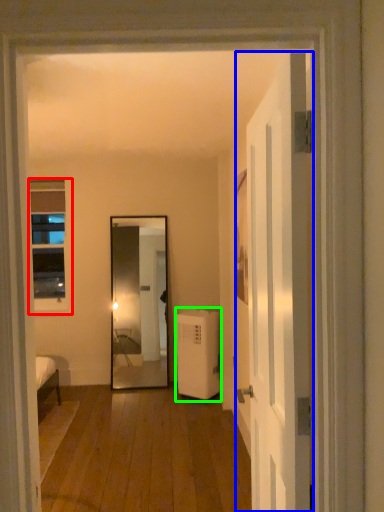
Question: Considering the real-world distances, which object is closest to window (highlighted by a red box)? door (highlighted by a blue box) or air conditioner (highlighted by a green box).

Choices:
 (A) door
 (B) air conditioner

Answer: (B)